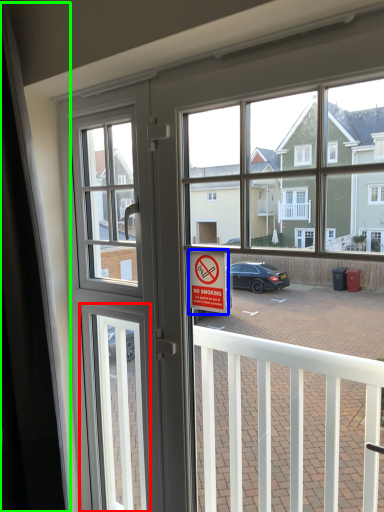
Question: Which is farther away from screen door (highlighted by a red box)? parking sign (highlighted by a blue box) or curtain (highlighted by a green box)?

Choices:
 (A) parking sign
 (B) curtain

Answer: (A)